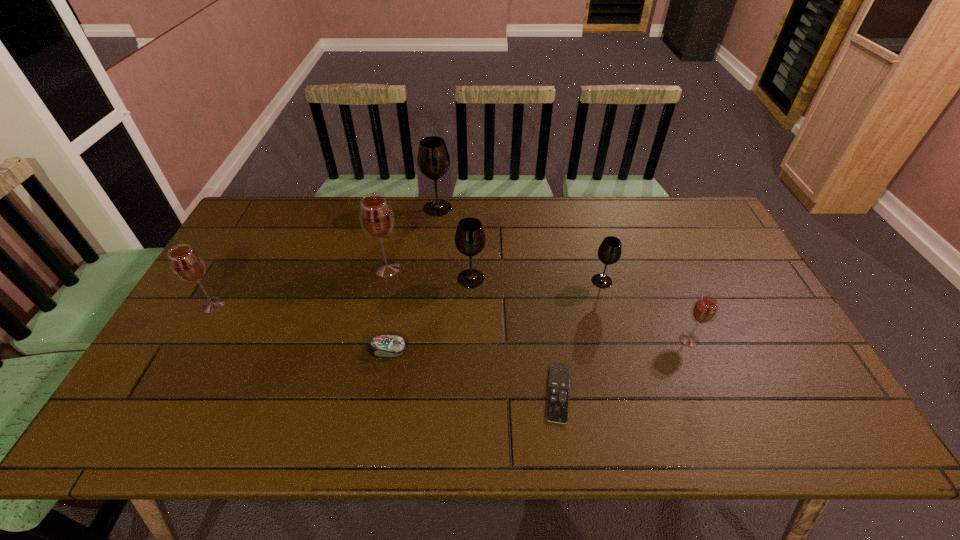
Where is `the rightmost gray wineglass`? Image resolution: width=960 pixels, height=540 pixels. the rightmost gray wineglass is located at coordinates [x=609, y=252].

In order to click on the second wineglass from right to left in this screenshot , I will do `click(609, 252)`.

Where is `computer mouse`? computer mouse is located at coordinates (389, 346).

Where is `the nearest object`? The image size is (960, 540). the nearest object is located at coordinates click(558, 389).

The image size is (960, 540). I want to click on the shortest object, so click(x=558, y=389).

The width and height of the screenshot is (960, 540). What are the coordinates of `vacant area situated on the front of the fourth wineglass from right to left` in the screenshot? It's located at (436, 226).

This screenshot has width=960, height=540. In order to click on vacant area situated on the left of the biggest red wineglass in this screenshot , I will do `click(319, 268)`.

Identify the location of vacant space situated 0.090m on the front of the leftmost red wineglass. (192, 342).

This screenshot has height=540, width=960. Identify the location of free space located on the back of the fifth object from left to right. (471, 253).

Find the location of `vacant space situated 0.380m on the back of the rightmost object`. vacant space situated 0.380m on the back of the rightmost object is located at coordinates (647, 239).